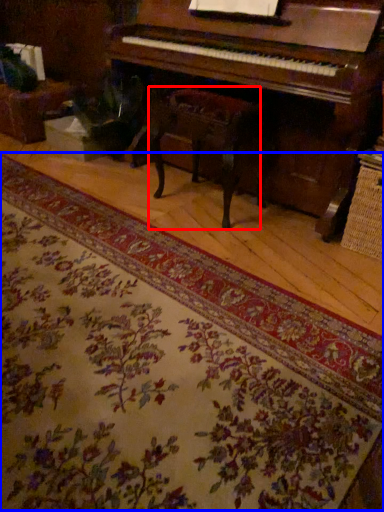
Question: Among these objects, which one is nearest to the camera, music stool (highlighted by a red box) or mat (highlighted by a blue box)?

Choices:
 (A) music stool
 (B) mat

Answer: (B)